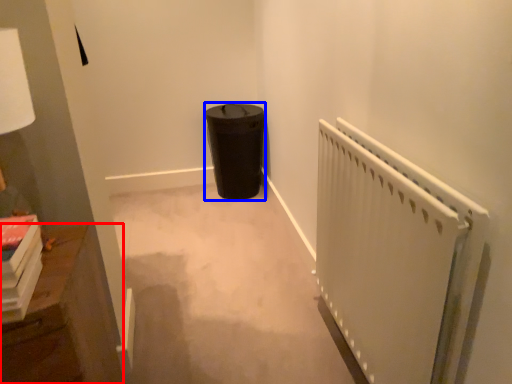
Question: Which object is further to the camera taking this photo, furniture (highlighted by a red box) or garbage (highlighted by a blue box)?

Choices:
 (A) furniture
 (B) garbage

Answer: (B)